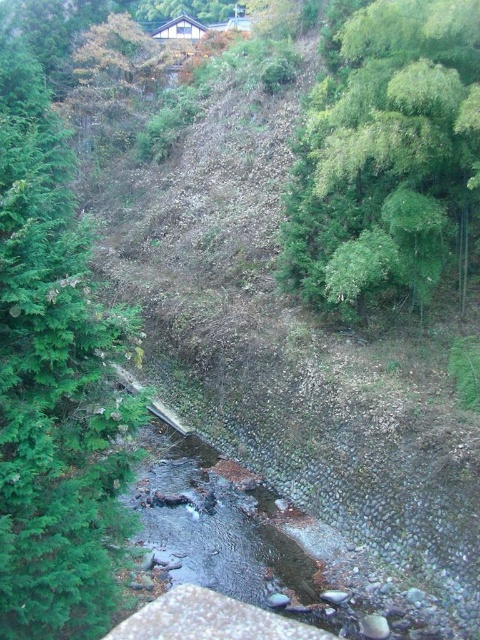
You are planning to set up a small campsite near the stream. You want to choose a spot that offers shade. Which tree would provide more coverage, the green textured tree at left or the green leafy tree at upper right?

The green textured tree at left is bigger than the green leafy tree at upper right, so it would provide more shade coverage.

You are standing at the point marked by point [54,384] and want to walk to the nearest green textured tree at left. Which direction should you face to start walking?

The point [54,384] is the location of the green textured tree at left, so you are already at the tree and do not need to move.